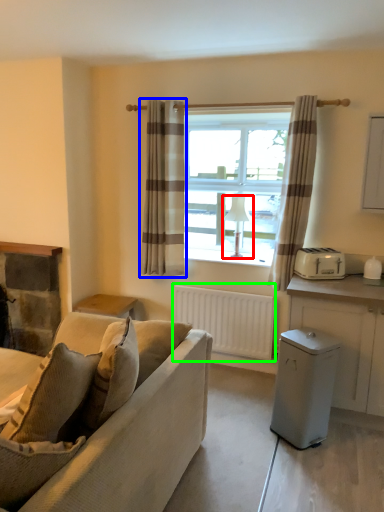
Question: Considering the real-world distances, which object is closest to lamp (highlighted by a red box)? curtain (highlighted by a blue box) or radiator (highlighted by a green box).

Choices:
 (A) curtain
 (B) radiator

Answer: (B)